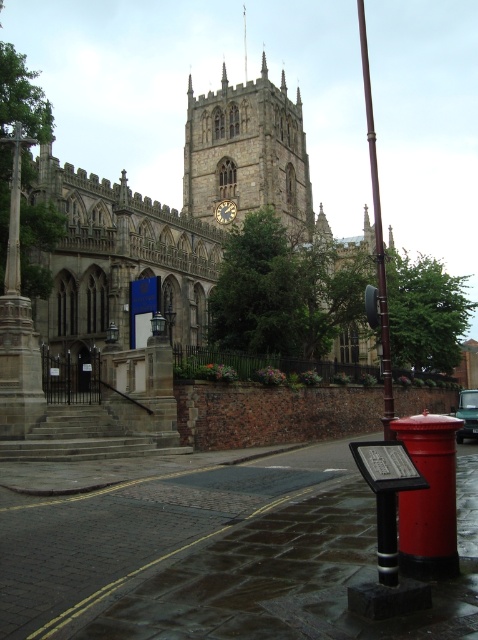
Question: Can you confirm if smooth brown pole at right is thinner than green matte car at center?

Choices:
 (A) no
 (B) yes

Answer: (A)

Question: Which point is closer to the camera?

Choices:
 (A) (371, 140)
 (B) (225, 188)
 (C) (37, 387)
 (D) (459, 440)

Answer: (C)

Question: Which object is farther from the camera taking this photo?

Choices:
 (A) green matte car at center
 (B) stone gothic church at center

Answer: (A)

Question: Can you confirm if stone gothic church at center is bigger than green matte car at center?

Choices:
 (A) yes
 (B) no

Answer: (A)

Question: Is stone gothic church at center positioned at the back of green matte car at center?

Choices:
 (A) yes
 (B) no

Answer: (B)

Question: Which object is positioned closest to the stone clock tower at center?

Choices:
 (A) green matte car at center
 (B) stone gothic church at center

Answer: (B)